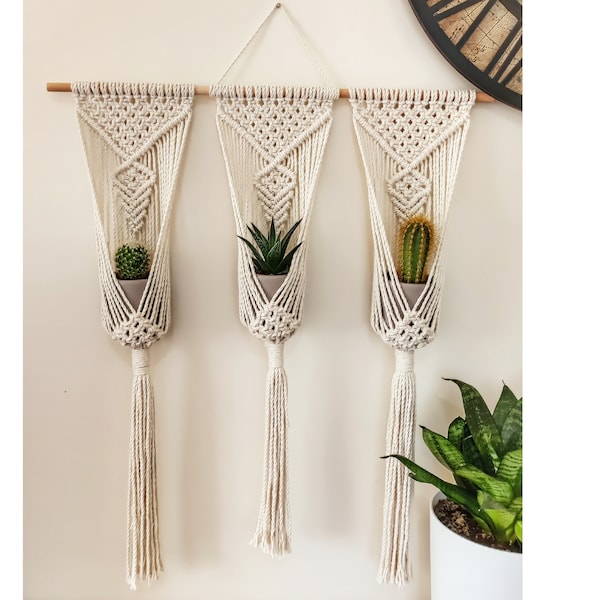
Where is `small cactus`? The image size is (600, 600). small cactus is located at coordinates (129, 267).